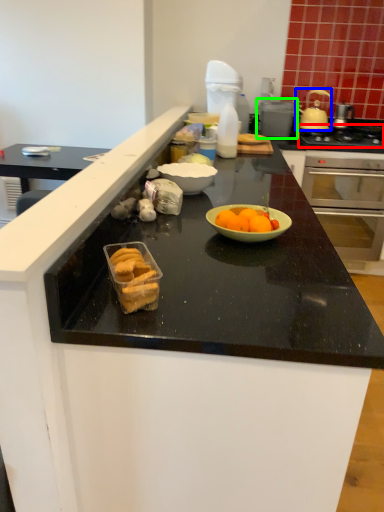
Question: Considering the real-world distances, which object is closest to gas stove (highlighted by a red box)? pot/pan (highlighted by a blue box) or appliance (highlighted by a green box).

Choices:
 (A) pot/pan
 (B) appliance

Answer: (A)